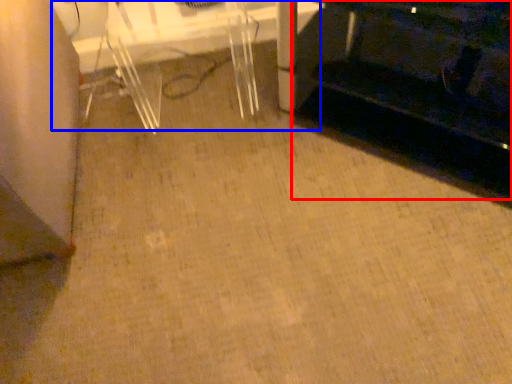
Question: Which of the following is the farthest to the observer, furniture (highlighted by a red box) or table (highlighted by a blue box)?

Choices:
 (A) furniture
 (B) table

Answer: (B)